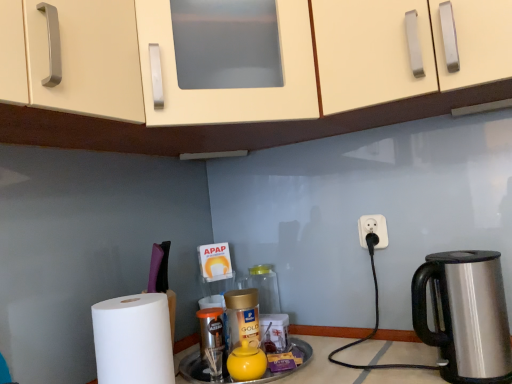
You are a GUI agent. You are given a task and a screenshot of the screen. Output one action in this format:
    pyautogui.click(x=<x>, y=<y>)
    Task: Click on the vacant area that is situated to the right of gold plastic bottle at center, which is the second bottle in back-to-front order
    This screenshot has width=512, height=384.
    Given the screenshot: What is the action you would take?
    pyautogui.click(x=300, y=359)